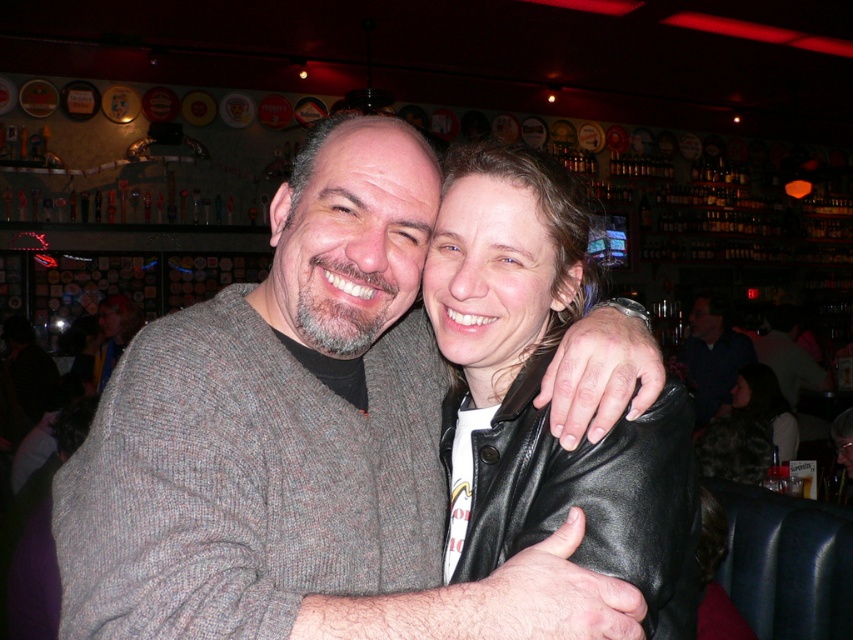
Question: Is black leather jacket at lower right to the left of dark blue shirt at center from the viewer's perspective?

Choices:
 (A) no
 (B) yes

Answer: (B)

Question: Is black leather jacket at lower right thinner than dark blue shirt at center?

Choices:
 (A) no
 (B) yes

Answer: (B)

Question: Which point is closer to the camera?

Choices:
 (A) dark blue shirt at center
 (B) black leather jacket at lower right

Answer: (B)

Question: Can you confirm if black leather jacket at lower right is positioned above dark blue shirt at center?

Choices:
 (A) no
 (B) yes

Answer: (A)

Question: Which point is farther to the camera?

Choices:
 (A) (695, 321)
 (B) (738, 442)

Answer: (A)